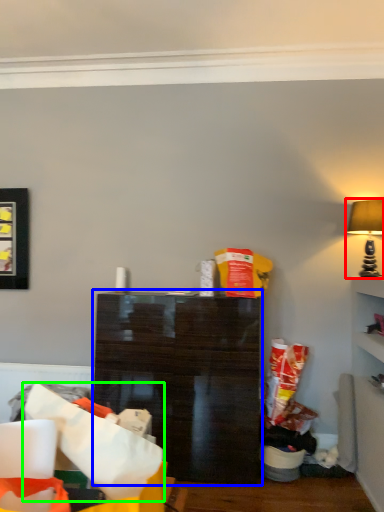
Question: Which is farther away from lamp (highlighted by a red box)? shelf (highlighted by a blue box) or paper bag (highlighted by a green box)?

Choices:
 (A) shelf
 (B) paper bag

Answer: (B)